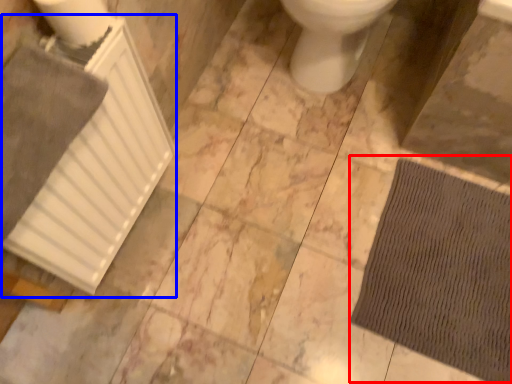
Question: Which point is closer to the camera, doormat (highlighted by a red box) or radiator (highlighted by a blue box)?

Choices:
 (A) doormat
 (B) radiator

Answer: (B)